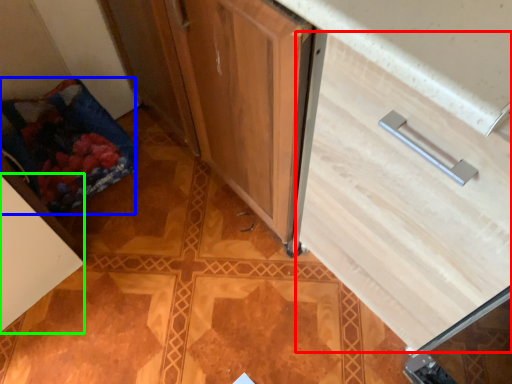
Question: Which object is positioned farthest from drawer (highlighted by a red box)? Select from material (highlighted by a blue box) and cabinetry (highlighted by a green box).

Choices:
 (A) material
 (B) cabinetry

Answer: (A)